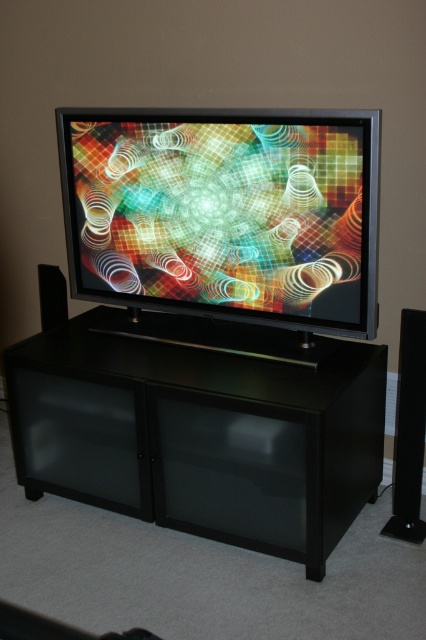
You are setting up a home theater system in the living room and need to place the black plastic speaker at right and the black matte speaker at left on the floor. Given that the space between the two speakers must be at least 1.2 meters for optimal sound quality, can you determine if the current arrangement allows this based on their widths?

The black plastic speaker at right has a lesser width compared to the black matte speaker at left. However, the exact widths are not provided, so we cannot determine if the space between them meets the 1.2 meters requirement without additional information.

You are setting up a new home theater system and need to place a 30 inch wide TV stand between the matte black flat screen tv at center and the black plastic speaker at right. Is there enough space between them to fit the TV stand?

The distance between the matte black flat screen tv at center and the black plastic speaker at right is 28.38 inches. Since the TV stand is 30 inches wide, there isn t enough space to fit it between them.

You are an interior designer planning to hang a large painting above the matte black flat screen tv at center. According to the coordinates provided, where should you position the center of the painting to ensure it aligns perfectly above the television?

The center of the painting should be positioned at the same x coordinate as the matte black flat screen tv at center, which is 0.333, but at a higher y coordinate to place it above the television.